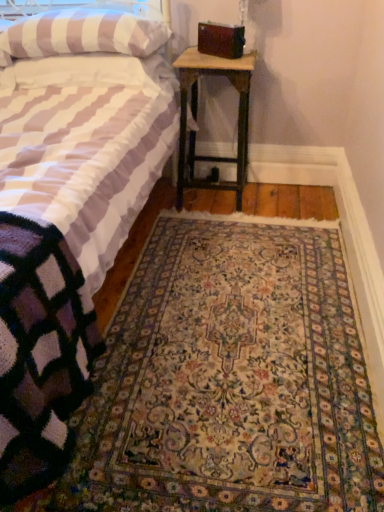
You are a GUI agent. You are given a task and a screenshot of the screen. Output one action in this format:
    pyautogui.click(x=<x>, y=<y>)
    Task: Click on the vacant area located to the right-hand side of wooden nightstand at lower right
    
    Given the screenshot: What is the action you would take?
    pyautogui.click(x=281, y=199)